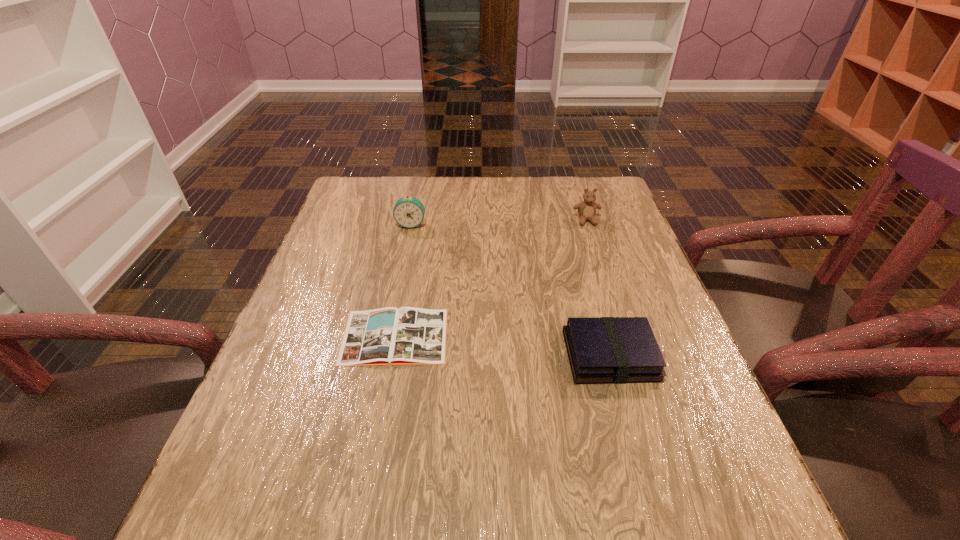
Image resolution: width=960 pixels, height=540 pixels. Find the location of `teddy bear positioned at the far edge`. teddy bear positioned at the far edge is located at coordinates (586, 209).

I want to click on alarm clock positioned at the far edge, so click(x=409, y=212).

The width and height of the screenshot is (960, 540). Identify the location of object that is at the left edge. coord(387,336).

This screenshot has height=540, width=960. I want to click on teddy bear located at the right edge, so click(x=586, y=209).

You are a GUI agent. You are given a task and a screenshot of the screen. Output one action in this format:
    pyautogui.click(x=<x>, y=<y>)
    Task: Click on the book present at the right edge
    This screenshot has height=540, width=960.
    Given the screenshot: What is the action you would take?
    pyautogui.click(x=601, y=350)

Find the location of `object positioned at the far right corner`. object positioned at the far right corner is located at coordinates (586, 209).

Find the location of `free space at the far edge`. free space at the far edge is located at coordinates [522, 181].

The width and height of the screenshot is (960, 540). In the image, there is a desktop. In order to click on vacant region at the near edge in this screenshot , I will do `click(339, 534)`.

Where is `blank area at the left edge`? blank area at the left edge is located at coordinates (231, 452).

In the image, there is a desktop. Identify the location of free space at the right edge. The width and height of the screenshot is (960, 540). (592, 225).